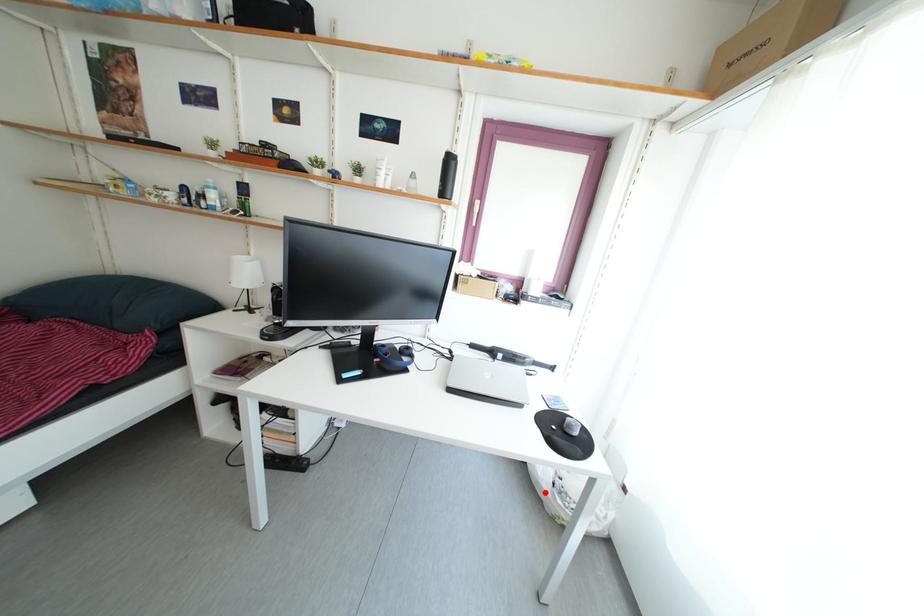
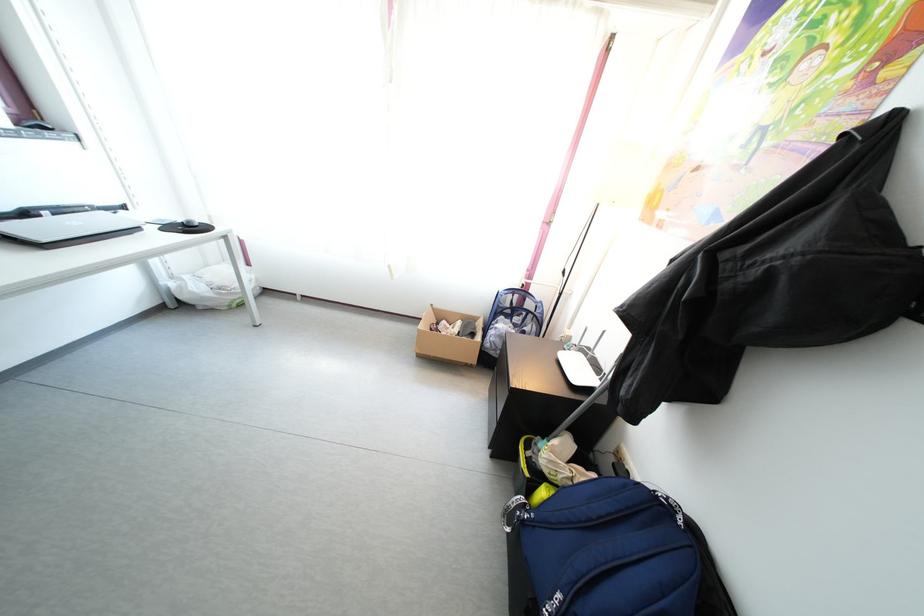
In the second image, find the point that corresponds to the highlighted location in the first image.

(210, 306)